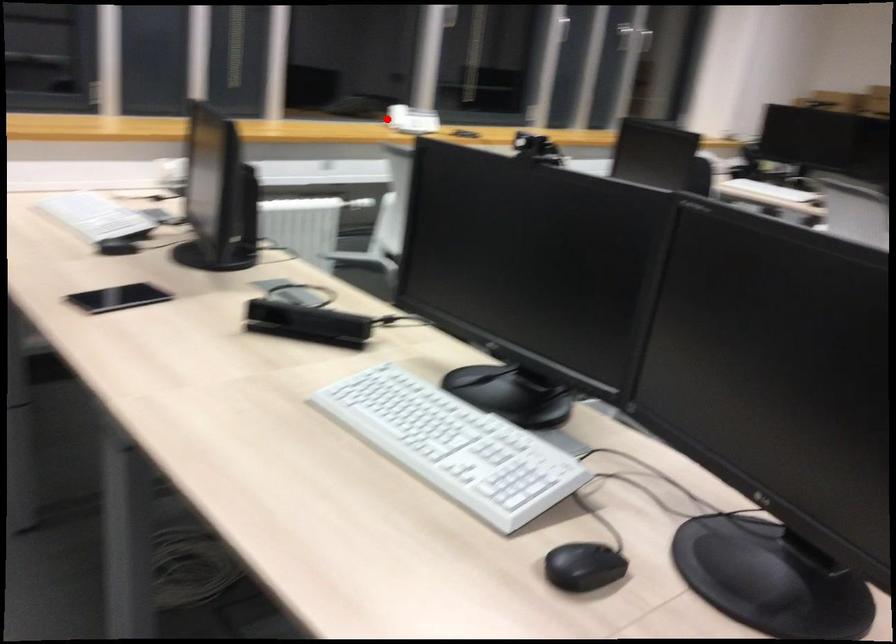
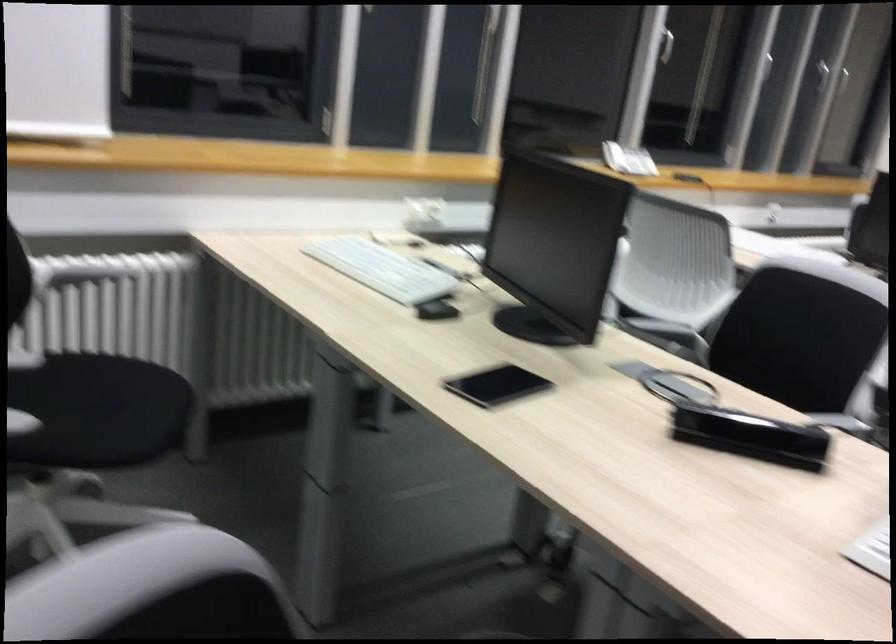
Question: I am providing you with two images of the same scene from different viewpoints. Image1 has a red point marked. In image2, the corresponding 3D location appears at what relative position? Reply with the corresponding letter.

Choices:
 (A) Closer
 (B) Farther

Answer: (A)